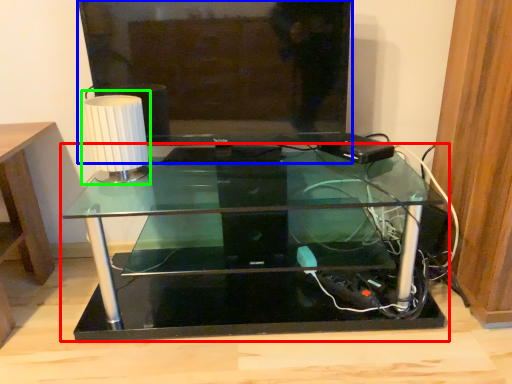
Question: Which object is the closest to the table (highlighted by a red box)? Choose among these: television (highlighted by a blue box) or table lamp (highlighted by a green box).

Choices:
 (A) television
 (B) table lamp

Answer: (A)